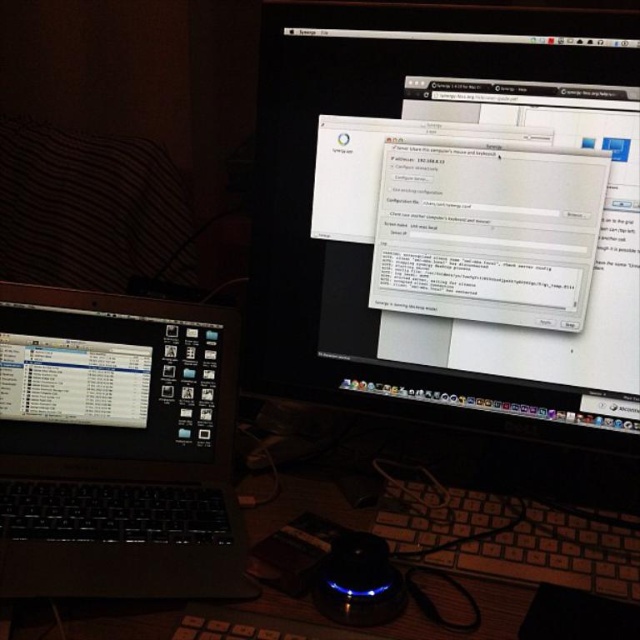
Question: Which of the following is the closest to the observer?

Choices:
 (A) (112, 401)
 (B) (342, 42)
 (C) (438, 556)
 (D) (513, 572)

Answer: (D)

Question: Does black glossy monitor at center appear on the right side of black plastic keyboard at lower center?

Choices:
 (A) yes
 (B) no

Answer: (B)

Question: Does black glossy monitor at center appear on the right side of wooden at lower left?

Choices:
 (A) no
 (B) yes

Answer: (B)

Question: Estimate the real-world distances between objects in this image. Which object is closer to the black glossy monitor at center?

Choices:
 (A) satin black laptop at left
 (B) black plastic keyboard at lower center

Answer: (B)

Question: Is black glossy monitor at center thinner than satin black laptop at left?

Choices:
 (A) no
 (B) yes

Answer: (A)

Question: Which of the following is the farthest from the observer?

Choices:
 (A) black plastic keyboard at lower center
 (B) black glossy monitor at center
 (C) wooden at lower left
 (D) satin black laptop at left

Answer: (B)